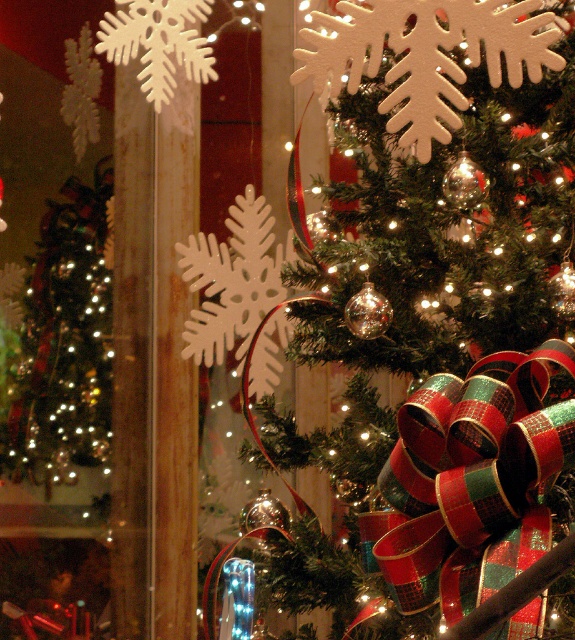
Question: Which point appears farthest from the camera in this image?

Choices:
 (A) (431, 460)
 (B) (89, 298)

Answer: (B)

Question: From the image, what is the correct spatial relationship of green matte christmas tree at center in relation to shiny gold ornaments at left?

Choices:
 (A) below
 (B) above

Answer: (B)

Question: Among these objects, which one is nearest to the camera?

Choices:
 (A) green matte christmas tree at center
 (B) shiny gold ornaments at left

Answer: (A)

Question: Does green matte christmas tree at center appear over shiny gold ornaments at left?

Choices:
 (A) yes
 (B) no

Answer: (A)

Question: Does green matte christmas tree at center have a smaller size compared to shiny gold ornaments at left?

Choices:
 (A) no
 (B) yes

Answer: (A)

Question: Which point is farther from the camera taking this photo?

Choices:
 (A) (426, 316)
 (B) (16, 452)

Answer: (B)